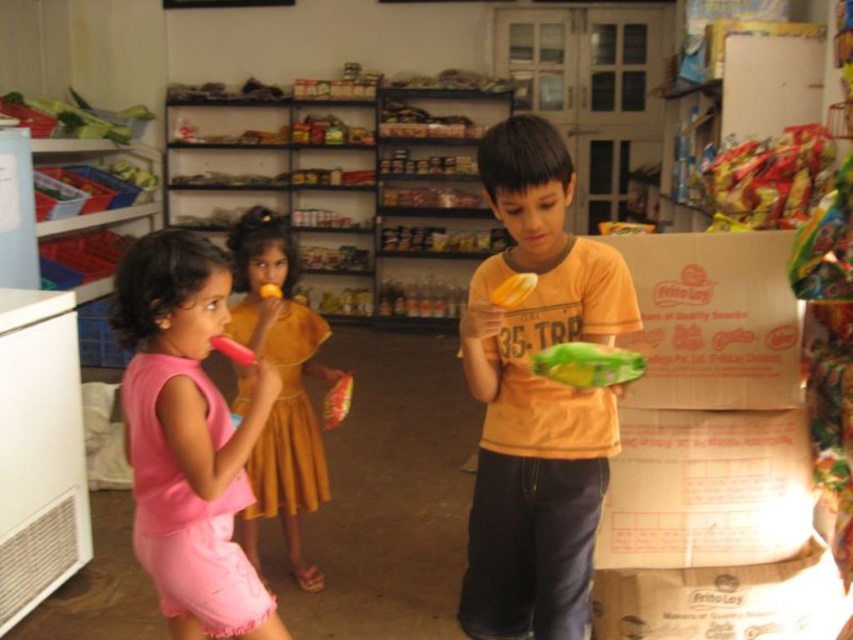
You are a parent in the store and want to ensure your child can reach the yellow matte snack at center without climbing. Considering the height of the pink fabric dress at left, which is worn by your child, can they reach the snack?

The pink fabric dress at left is taller than the yellow matte snack at center, so your child wearing the pink fabric dress at left can likely reach the snack without needing to climb.

You are standing in the grocery store and want to reach both points in the image. Which point, point [495,419] or point [344,388], is closer to you?

Point [495,419] is closer to the viewer than point [344,388].

You are a parent trying to buy a new dress for your child. You see the orange cotton shirt at center and the pink fabric dress at left in the store. Which clothing item has a wider width?

The orange cotton shirt at center has a larger width than the pink fabric dress at left.